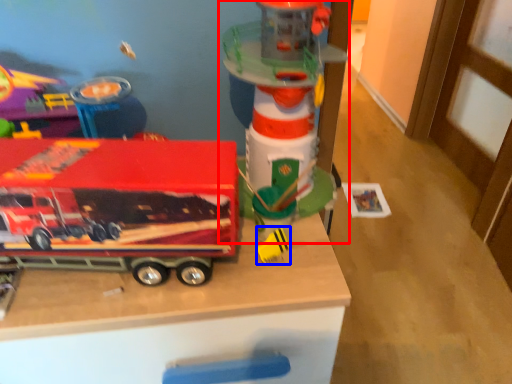
Question: Which object is further to the camera taking this photo, toy (highlighted by a red box) or toy (highlighted by a blue box)?

Choices:
 (A) toy
 (B) toy

Answer: (B)